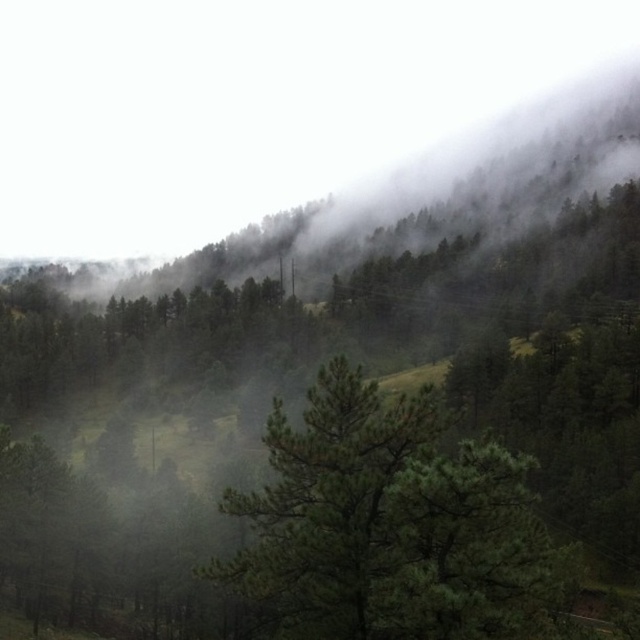
You are a hiker trying to navigate through the forest. You see the foggy mist at upper center and the green matte tree at center. Which object is higher in the image?

The foggy mist at upper center is positioned over the green matte tree at center, so the foggy mist at upper center is higher in the image.

You are a hiker standing at the base of the slope in the forest scene. You see the foggy mist at upper center and the green matte tree at center. Which object is farther away from you?

The foggy mist at upper center is 330.92 meters away from the green matte tree at center, so the foggy mist at upper center is farther away from you than the green matte tree at center.

You are standing in the misty forest and want to walk from the point at coordinates point (116, 141) to the point at coordinates point (312, 477). Which direction should you move relative to the camera perspective?

You should move downward and to the right because point (116, 141) is further to the camera than point (312, 477), so to reach the latter, you need to descend towards the lower right direction from the camera view.